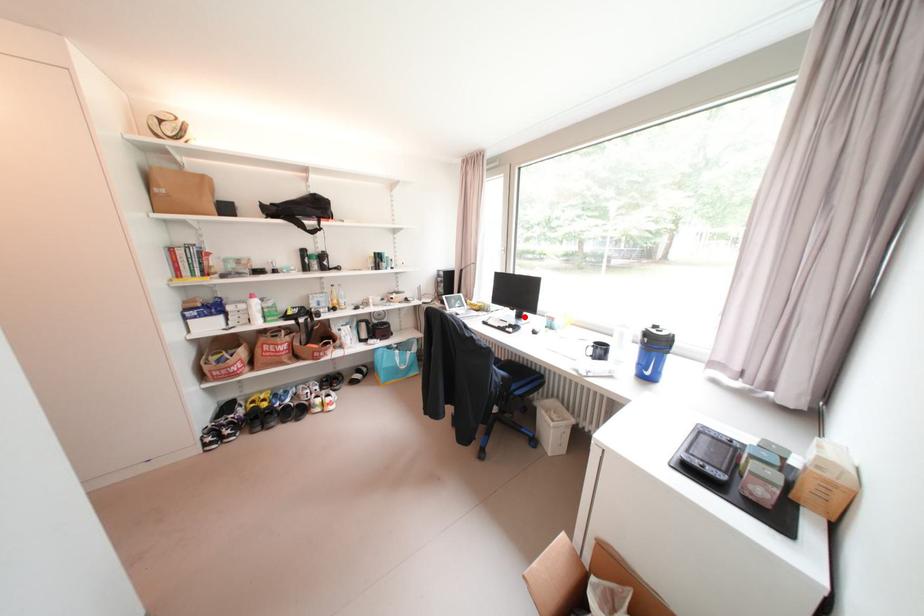
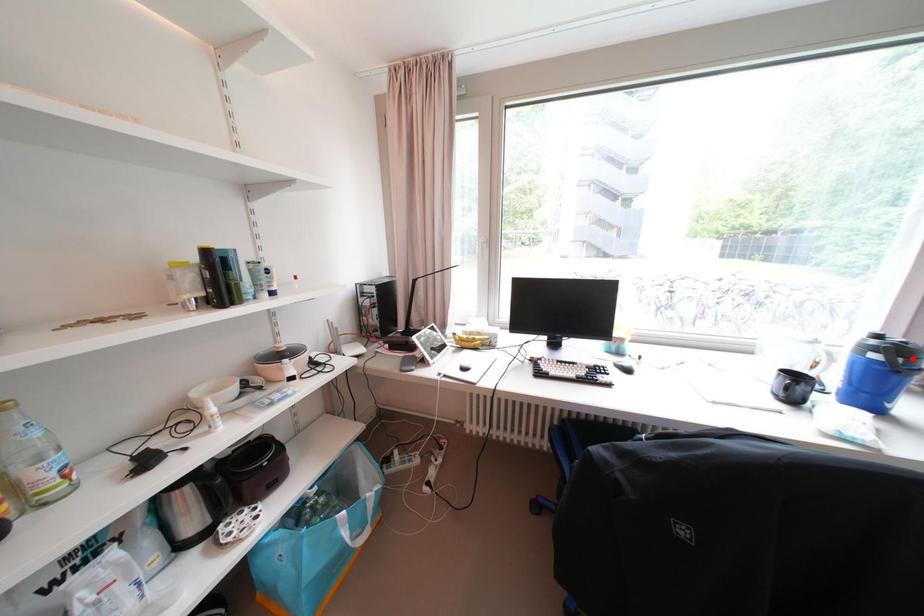
I am providing you with two images of the same scene from different viewpoints. A red point is marked on the first image and another point is marked on the second image. Is the red point in image1 aligned with the point shown in image2?

No